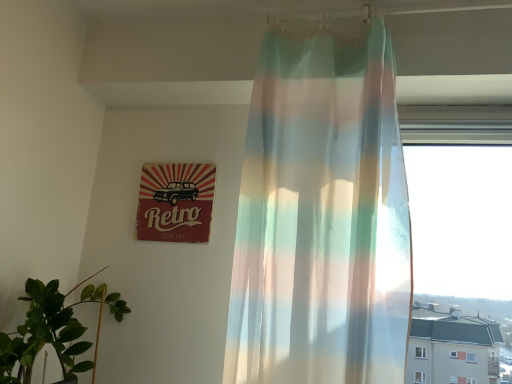
Question: Is translucent pastel curtain at center oriented away from retro paper sign at upper left?

Choices:
 (A) yes
 (B) no

Answer: (B)

Question: Does translucent pastel curtain at center lie behind retro paper sign at upper left?

Choices:
 (A) no
 (B) yes

Answer: (A)

Question: Is translucent pastel curtain at center not close to retro paper sign at upper left?

Choices:
 (A) no
 (B) yes

Answer: (A)

Question: Can you see translucent pastel curtain at center touching retro paper sign at upper left?

Choices:
 (A) yes
 (B) no

Answer: (B)

Question: Is translucent pastel curtain at center taller than retro paper sign at upper left?

Choices:
 (A) yes
 (B) no

Answer: (A)

Question: Based on their positions, is retro paper sign at upper left located to the left or right of green leafy plant at lower left?

Choices:
 (A) left
 (B) right

Answer: (B)

Question: From a real-world perspective, is retro paper sign at upper left above or below green leafy plant at lower left?

Choices:
 (A) below
 (B) above

Answer: (B)

Question: Choose the correct answer: Is retro paper sign at upper left inside green leafy plant at lower left or outside it?

Choices:
 (A) inside
 (B) outside

Answer: (B)

Question: In terms of width, does retro paper sign at upper left look wider or thinner when compared to green leafy plant at lower left?

Choices:
 (A) wide
 (B) thin

Answer: (B)

Question: Would you say retro paper sign at upper left is to the left or to the right of translucent pastel curtain at center in the picture?

Choices:
 (A) left
 (B) right

Answer: (A)

Question: Relative to translucent pastel curtain at center, is retro paper sign at upper left in front or behind?

Choices:
 (A) behind
 (B) front

Answer: (A)

Question: Is point tap(188, 231) positioned closer to the camera than point tap(266, 259)?

Choices:
 (A) farther
 (B) closer

Answer: (A)

Question: Looking at the image, does retro paper sign at upper left seem bigger or smaller compared to translucent pastel curtain at center?

Choices:
 (A) big
 (B) small

Answer: (B)

Question: Is translucent pastel curtain at center taller or shorter than retro paper sign at upper left?

Choices:
 (A) tall
 (B) short

Answer: (A)

Question: Looking at the image, does translucent pastel curtain at center seem bigger or smaller compared to retro paper sign at upper left?

Choices:
 (A) big
 (B) small

Answer: (A)